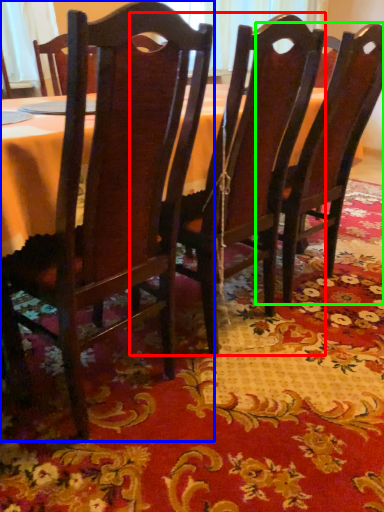
Question: Which object is the closest to the chair (highlighted by a red box)? Choose among these: chair (highlighted by a blue box) or chair (highlighted by a green box).

Choices:
 (A) chair
 (B) chair

Answer: (B)